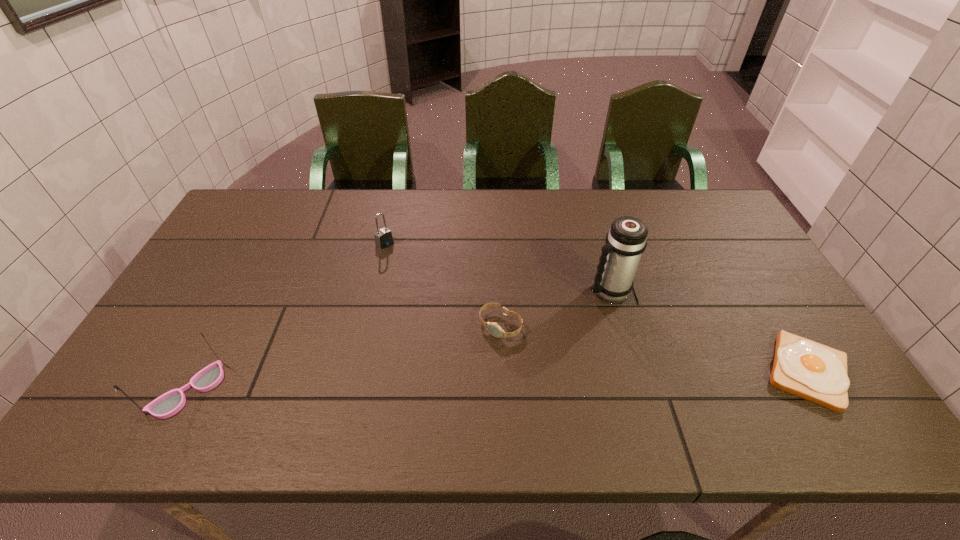
Where is `vacant space at the right edge`? vacant space at the right edge is located at coordinates (739, 264).

This screenshot has width=960, height=540. Identify the location of free space at the far left corner of the desktop. (256, 197).

In the image, there is a desktop. Where is `vacant region at the near left corner`? Image resolution: width=960 pixels, height=540 pixels. vacant region at the near left corner is located at coordinates (131, 371).

What are the coordinates of `vacant space at the far right corner` in the screenshot? It's located at coord(681,213).

Where is `empty location between the fourth nearest object and the shortest object`? The image size is (960, 540). empty location between the fourth nearest object and the shortest object is located at coordinates (708, 331).

This screenshot has height=540, width=960. Find the location of `vacant space that is in between the thermos bottle and the watch`. vacant space that is in between the thermos bottle and the watch is located at coordinates (554, 308).

In order to click on free space between the fourth object from left to right and the fourth shortest object in this screenshot , I will do `click(398, 341)`.

This screenshot has width=960, height=540. I want to click on vacant space that is in between the padlock and the third object from right to left, so click(x=443, y=285).

Image resolution: width=960 pixels, height=540 pixels. I want to click on vacant area that lies between the second object from right to left and the toast, so click(708, 331).

Where is `vacant area that lies between the second shortest object and the fourth object from right to left`? vacant area that lies between the second shortest object and the fourth object from right to left is located at coordinates (443, 285).